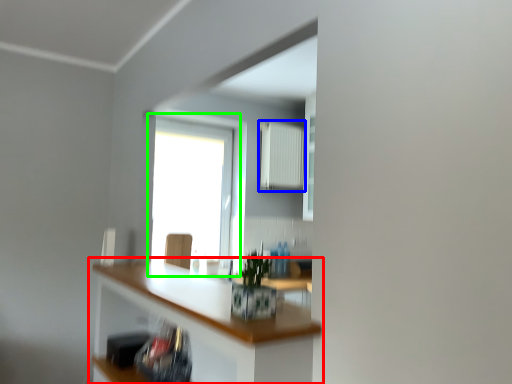
Question: Estimate the real-world distances between objects in this image. Which object is farther from countertop (highlighted by a red box), radiator (highlighted by a blue box) or window (highlighted by a green box)?

Choices:
 (A) radiator
 (B) window

Answer: (A)